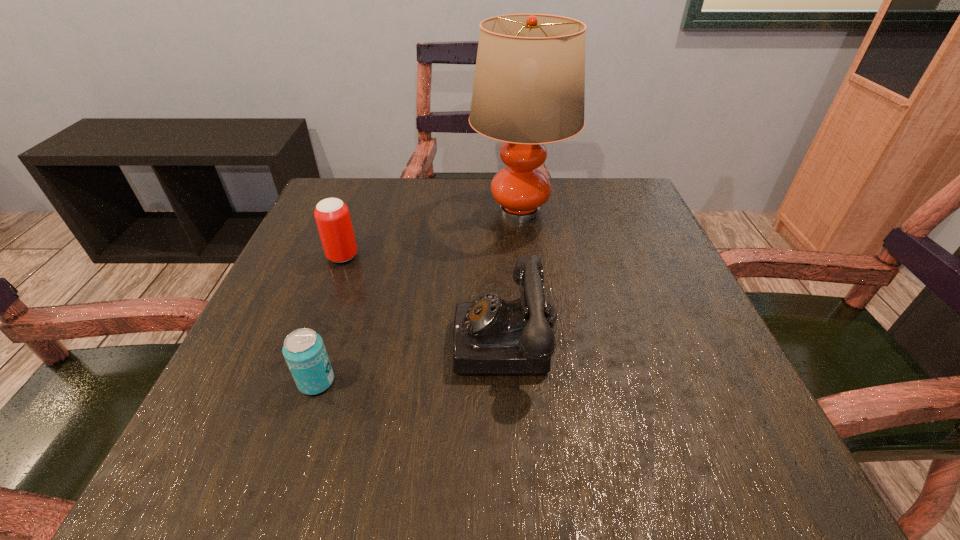
At what (x,y) coordinates should I click in order to perform the action: click on the tallest object. Please return your answer as a coordinate pair (x, y). Looking at the image, I should click on (529, 86).

At what (x,y) coordinates should I click in order to perform the action: click on the farthest object. Please return your answer as a coordinate pair (x, y). Looking at the image, I should click on point(529,86).

Find the location of a particular element. The image size is (960, 540). telephone is located at coordinates (491, 335).

Locate an element on the screen. The height and width of the screenshot is (540, 960). the third nearest object is located at coordinates (332, 216).

This screenshot has height=540, width=960. I want to click on the taller beer can, so click(332, 216).

Where is `the shorter beer can`? The height and width of the screenshot is (540, 960). the shorter beer can is located at coordinates (304, 351).

You are a GUI agent. You are given a task and a screenshot of the screen. Output one action in this format:
    pyautogui.click(x=<x>, y=<y>)
    Task: Click on the shortest object
    This screenshot has width=960, height=540.
    Given the screenshot: What is the action you would take?
    pyautogui.click(x=304, y=351)

You are a GUI agent. You are given a task and a screenshot of the screen. Output one action in this format:
    pyautogui.click(x=<x>, y=<y>)
    Task: Click on the vacant area located 0.160m on the front of the lamp
    
    Given the screenshot: What is the action you would take?
    pyautogui.click(x=530, y=291)

Where is `free location located 0.130m on the dial of the telephone`? The height and width of the screenshot is (540, 960). free location located 0.130m on the dial of the telephone is located at coordinates (377, 340).

Identify the location of vacant region located on the dial of the telephone. (306, 340).